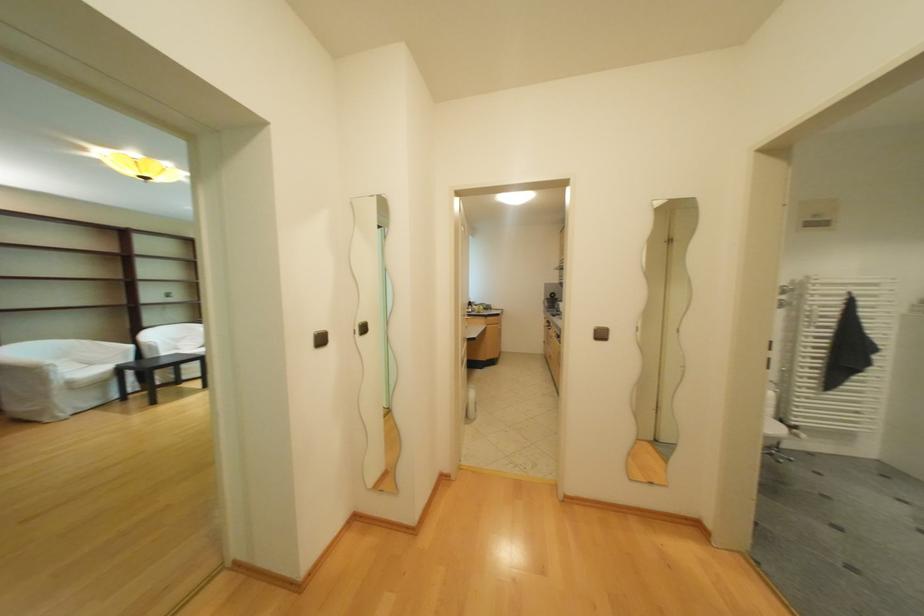
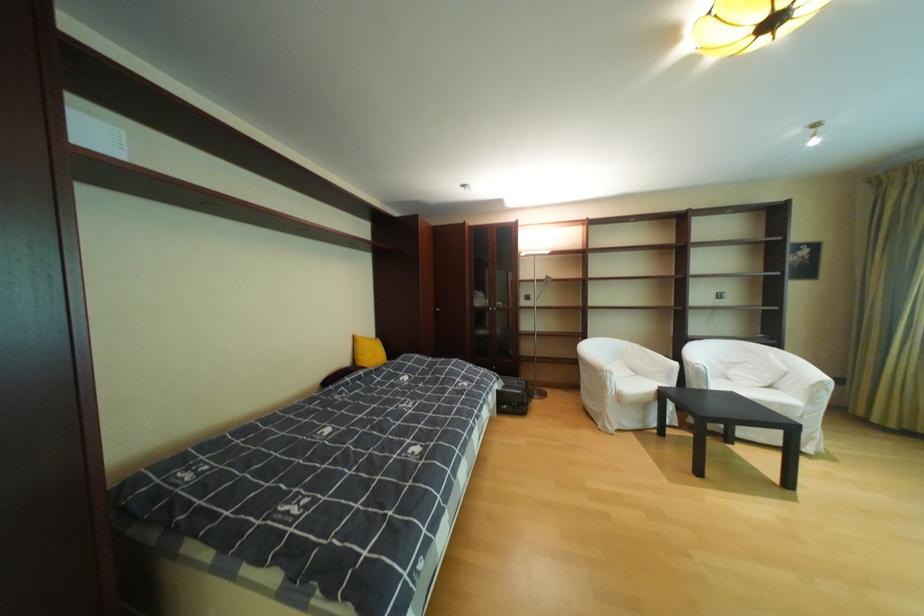
Where in the second image is the point corresponding to [65,370] from the first image?

(621, 377)